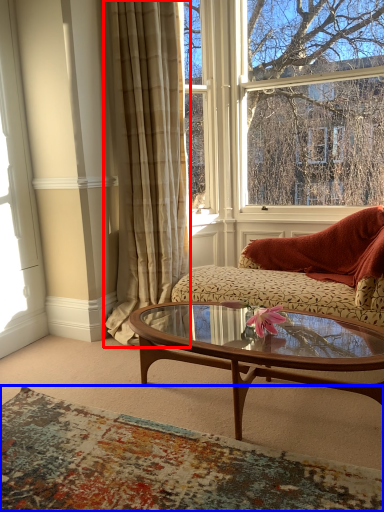
Question: Among these objects, which one is farthest to the camera, curtain (highlighted by a red box) or plain (highlighted by a blue box)?

Choices:
 (A) curtain
 (B) plain

Answer: (A)